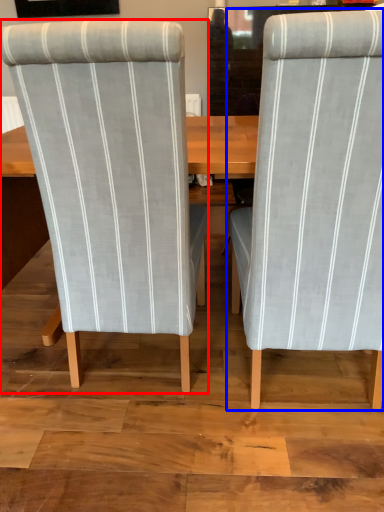
Question: Which of the following is the farthest to the observer, chair (highlighted by a red box) or chair (highlighted by a blue box)?

Choices:
 (A) chair
 (B) chair

Answer: (A)